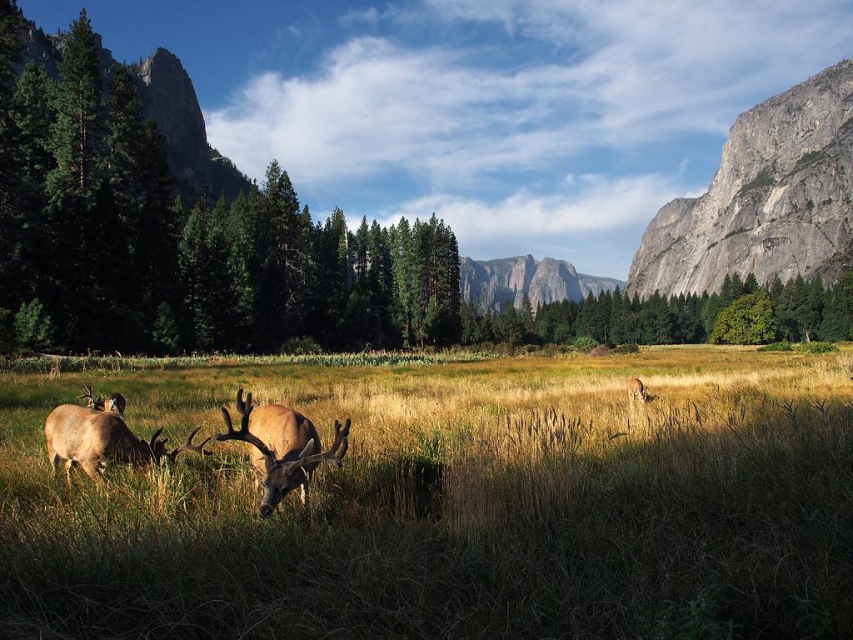
This screenshot has width=853, height=640. I want to click on gray rock cliff at right, so coord(762,198).

Between point (682, 225) and point (267, 490), which one is positioned behind?

The point (682, 225) is behind.

Which is below, gray rock cliff at right or brown velvet deer at center?

brown velvet deer at center is below.

Which is behind, point (706, 257) or point (254, 435)?

The point (706, 257) is more distant.

Locate an element on the screen. gray rock cliff at right is located at coordinates (762, 198).

Can you confirm if green textured pine tree at left is taller than gray rock cliff at right?

No, green textured pine tree at left is not taller than gray rock cliff at right.

Does point (39, 145) come in front of point (770, 186)?

That is True.

This screenshot has height=640, width=853. What do you see at coordinates (183, 232) in the screenshot?
I see `green textured pine tree at left` at bounding box center [183, 232].

Image resolution: width=853 pixels, height=640 pixels. Identify the location of green textured pine tree at left. (183, 232).